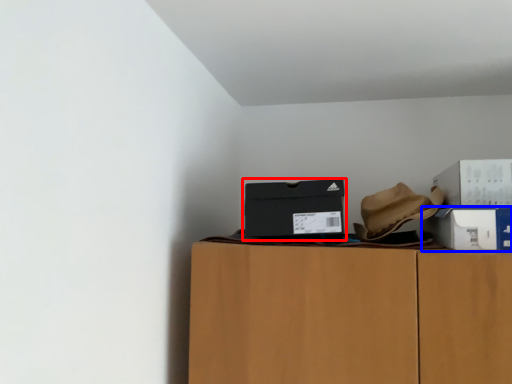
Question: Among these objects, which one is farthest to the camera, box (highlighted by a red box) or box (highlighted by a blue box)?

Choices:
 (A) box
 (B) box

Answer: (A)